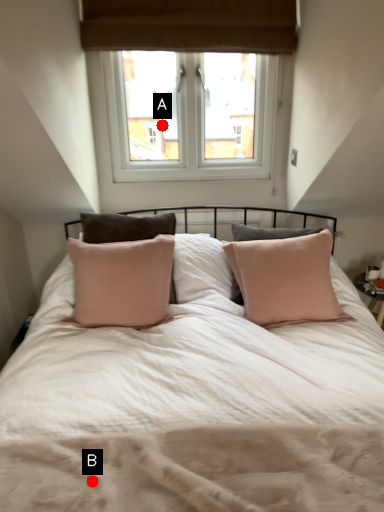
Question: Two points are circled on the image, labeled by A and B beside each circle. Which point is closer to the camera?

Choices:
 (A) A is closer
 (B) B is closer

Answer: (B)